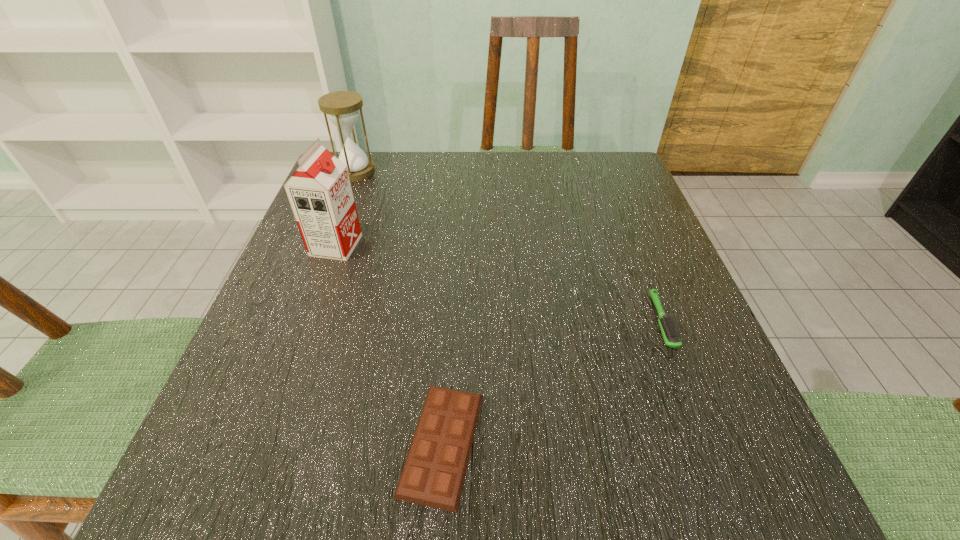
This screenshot has height=540, width=960. What are the coordinates of `free region at the left edge` in the screenshot? It's located at (335, 351).

Find the location of a particular element. vacant space at the right edge of the desktop is located at coordinates (694, 341).

This screenshot has width=960, height=540. What are the coordinates of `free space at the far right corner of the desktop` in the screenshot? It's located at (575, 171).

This screenshot has width=960, height=540. In order to click on vacant point at the near right corner in this screenshot , I will do `click(692, 450)`.

Where is `vacant space in between the nearest object and the rightmost object`? This screenshot has width=960, height=540. vacant space in between the nearest object and the rightmost object is located at coordinates (552, 382).

Find the location of a particular element. This screenshot has height=540, width=960. free area in between the third object from left to right and the second tallest object is located at coordinates (398, 307).

In order to click on unoccupied area between the third farthest object and the chocolate bar in this screenshot , I will do `click(552, 382)`.

The width and height of the screenshot is (960, 540). In order to click on free area in between the tallest object and the third farthest object in this screenshot , I will do (499, 283).

Where is `free space between the shortest object and the hourglass`? The height and width of the screenshot is (540, 960). free space between the shortest object and the hourglass is located at coordinates (398, 307).

The width and height of the screenshot is (960, 540). I want to click on vacant area between the second nearest object and the second farthest object, so click(x=499, y=283).